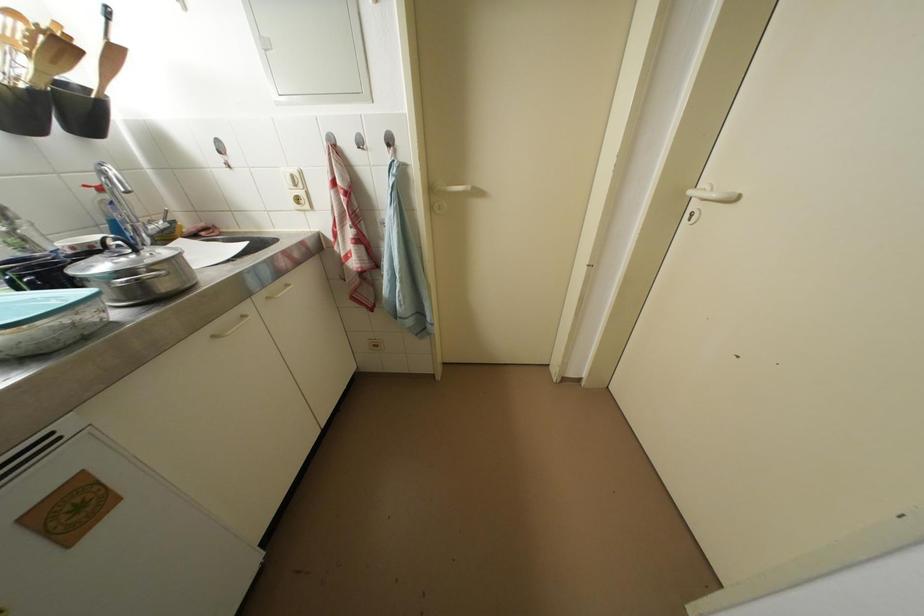
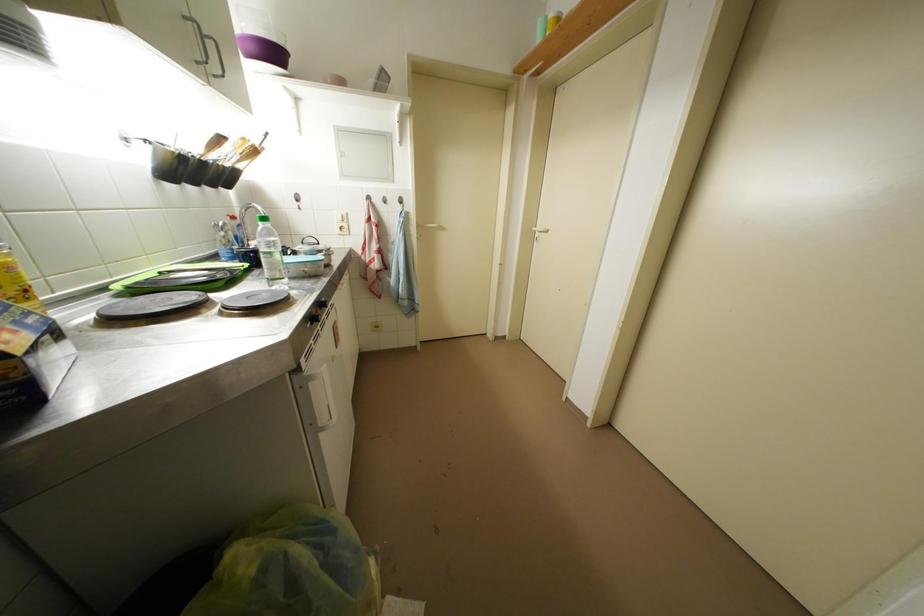
Question: The first image is from the beginning of the video and the second image is from the end. How did the camera likely rotate when shooting the video?

Choices:
 (A) Left
 (B) Right
 (C) Up
 (D) Down

Answer: (B)